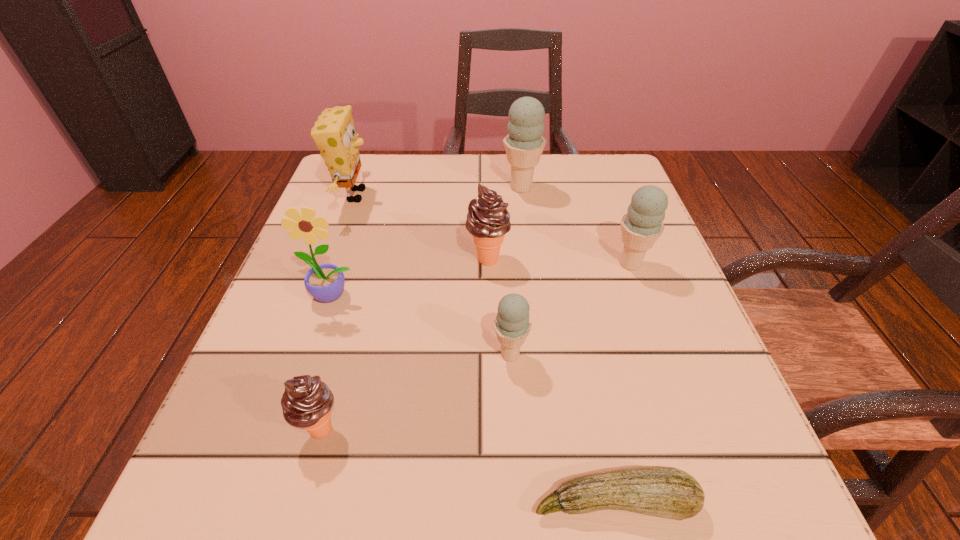
The height and width of the screenshot is (540, 960). What are the coordinates of `vacant point located on the left of the smaller chocolate icecream` in the screenshot? It's located at (254, 429).

The width and height of the screenshot is (960, 540). In order to click on ice cream that is at the far edge in this screenshot , I will do `click(524, 144)`.

This screenshot has height=540, width=960. I want to click on sponge present at the far edge, so click(335, 136).

You are a GUI agent. You are given a task and a screenshot of the screen. Output one action in this format:
    pyautogui.click(x=<x>, y=<y>)
    Task: Click on the object that is at the near edge
    
    Given the screenshot: What is the action you would take?
    pyautogui.click(x=666, y=492)

Locate an element on the screen. The width and height of the screenshot is (960, 540). sunflower at the left edge is located at coordinates (325, 282).

Find the location of `sponge located at the left edge`. sponge located at the left edge is located at coordinates (335, 136).

The width and height of the screenshot is (960, 540). What are the coordinates of `icecream present at the left edge` in the screenshot? It's located at (307, 401).

Find the location of `ice cream that is at the right edge`. ice cream that is at the right edge is located at coordinates (642, 225).

I want to click on zucchini present at the right edge, so click(666, 492).

I want to click on object that is at the far left corner, so click(x=335, y=136).